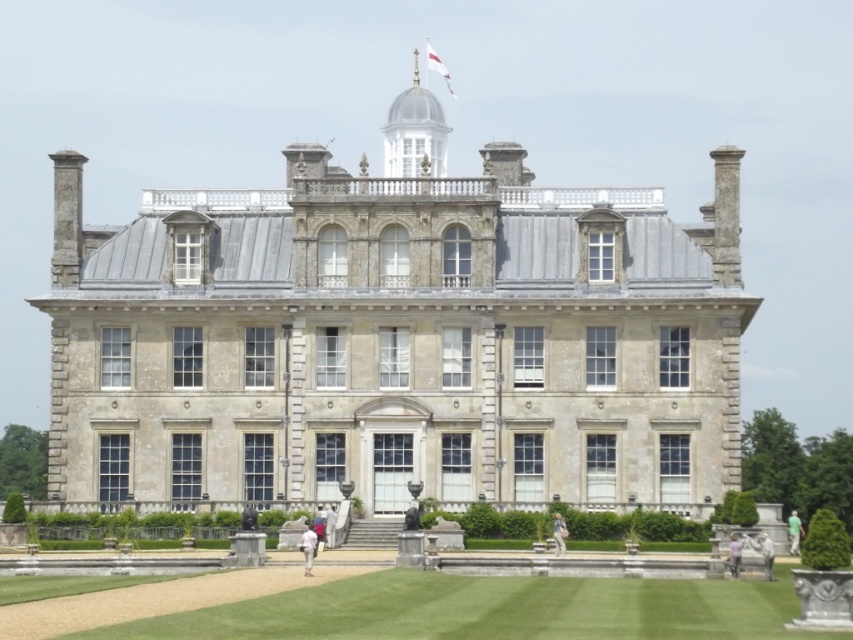
Question: Is green fabric shirt at center smaller than light gray stone statue at lower right?

Choices:
 (A) no
 (B) yes

Answer: (A)

Question: Which object is the closest to the blurred fabric person at center?

Choices:
 (A) light blue jeans at center
 (B) green fabric shirt at center

Answer: (A)

Question: Which object is farther from the camera taking this photo?

Choices:
 (A) green fabric shirt at center
 (B) light gray stone statue at lower right
 (C) white fabric person at center
 (D) green grass at lower center

Answer: (A)

Question: Can you confirm if stone mansion at center is positioned above green fabric shirt at center?

Choices:
 (A) yes
 (B) no

Answer: (A)

Question: Which point appears closest to the camera in this image?

Choices:
 (A) (759, 545)
 (B) (561, 544)
 (C) (305, 260)

Answer: (A)

Question: Is white fabric person at center further to camera compared to light purple fabric at center?

Choices:
 (A) yes
 (B) no

Answer: (B)